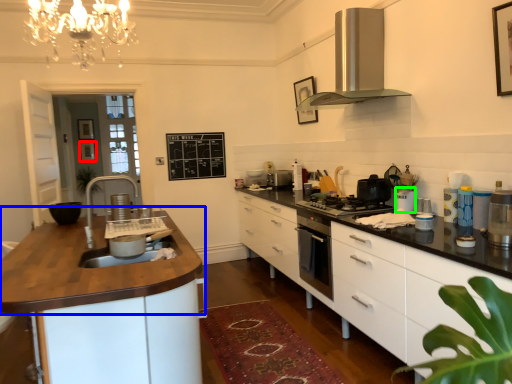
Question: Estimate the real-world distances between objects in this image. Which object is closer to picture frame (highlighted by a red box), countertop (highlighted by a blue box) or appliance (highlighted by a green box)?

Choices:
 (A) countertop
 (B) appliance

Answer: (A)